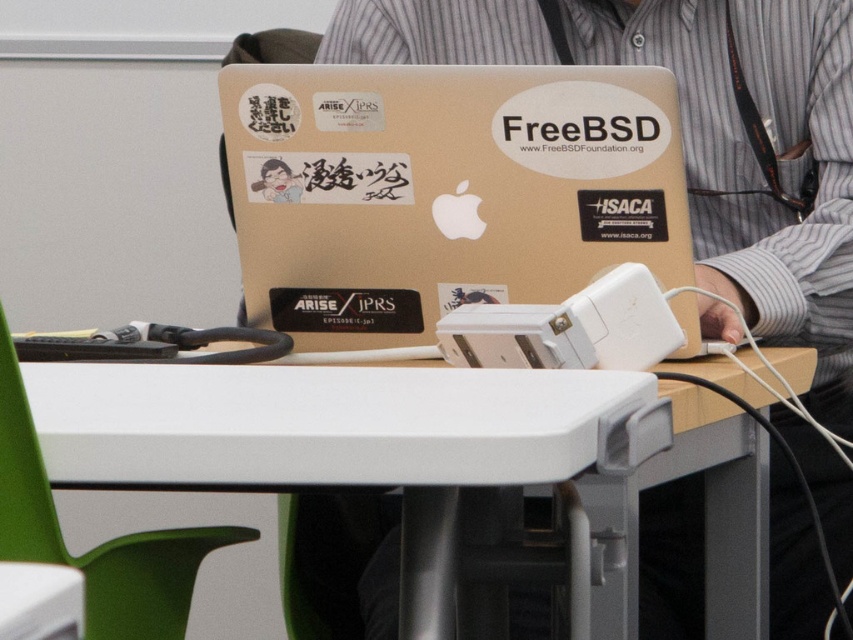
You are setting up a workspace and need to place both the metallic gold laptop at center and the white plastic table at center on a shelf. Which object should you place first to ensure both fit on the shelf?

The metallic gold laptop at center has a larger size compared to the white plastic table at center, so you should place the metallic gold laptop at center first to ensure both fit on the shelf.

You are a delivery person who needs to place a new laptop on the desk without moving the existing laptops. The new laptop is 30 centimeters long. Is there enough space between the glossy plastic laptop at center and the metallic gold laptop at center to fit the new laptop?

The distance between the glossy plastic laptop at center and the metallic gold laptop at center is 28.25 centimeters. Since the new laptop is 30 centimeters long, it is 1.75 centimeters too long to fit in the available space.

You are organizing a workspace and need to place a new keyboard on the desk. Given the current setup, can the glossy plastic laptop at center and the white plastic table at center accommodate the keyboard without moving any existing items?

The glossy plastic laptop at center occupies less space than the white plastic table at center, so there should be enough space left on the white plastic table at center to place the keyboard without moving anything.